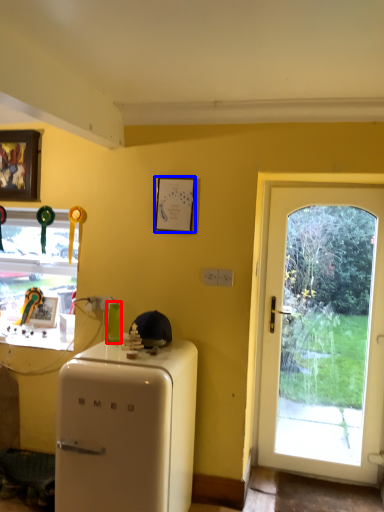
Question: Among these objects, which one is nearest to the camera, bottle (highlighted by a red box) or picture frame (highlighted by a blue box)?

Choices:
 (A) bottle
 (B) picture frame

Answer: (A)